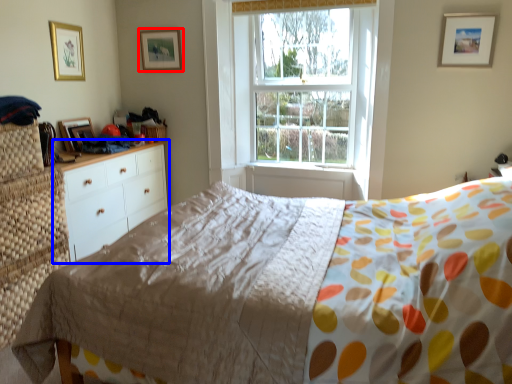
Question: Among these objects, which one is nearest to the camera, picture frame (highlighted by a red box) or chest of drawers (highlighted by a blue box)?

Choices:
 (A) picture frame
 (B) chest of drawers

Answer: (B)